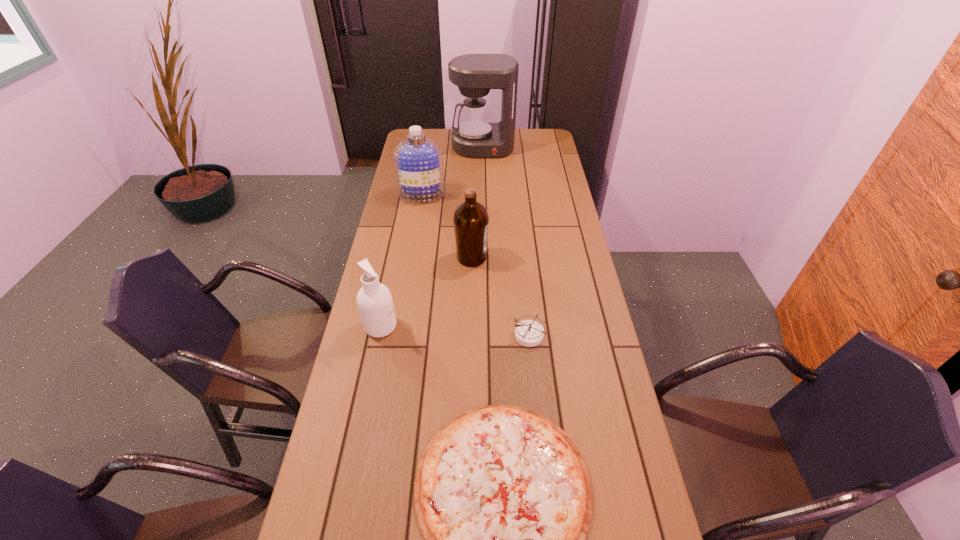
Locate an element on the screen. This screenshot has width=960, height=540. free space between the tallest object and the shorter cleansing agent is located at coordinates (432, 237).

Locate an element on the screen. Image resolution: width=960 pixels, height=540 pixels. vacant space in between the nearer cleansing agent and the compass is located at coordinates (455, 330).

At what (x,y) coordinates should I click in order to perform the action: click on free spot between the shorter cleansing agent and the tallest object. Please return your answer as a coordinate pair (x, y). The height and width of the screenshot is (540, 960). Looking at the image, I should click on (432, 237).

Image resolution: width=960 pixels, height=540 pixels. Identify the location of free spot between the farthest object and the second shortest object. (507, 241).

Where is `object that is the second closest to the farther cleansing agent`? This screenshot has width=960, height=540. object that is the second closest to the farther cleansing agent is located at coordinates (471, 220).

Find the location of a particular element. The width and height of the screenshot is (960, 540). the fifth closest object relative to the taller cleansing agent is located at coordinates (503, 497).

In order to click on vacant space that satisfies the following two spatial constraints: 1. on the front label of the second shortest object; 2. on the left side of the shorter cleansing agent in this screenshot , I will do point(379,335).

You are a GUI agent. You are given a task and a screenshot of the screen. Output one action in this format:
    pyautogui.click(x=<x>, y=<y>)
    Task: Click on the vacant space that satisfies the following two spatial constraints: 1. on the front side of the farther cleansing agent; 2. on the front label of the nearer cleansing agent
    This screenshot has height=540, width=960.
    Given the screenshot: What is the action you would take?
    pyautogui.click(x=400, y=326)

The image size is (960, 540). Find the location of `free space that satisfies the following two spatial constraints: 1. on the label of the fourth nearest object; 2. on the back side of the compass`. free space that satisfies the following two spatial constraints: 1. on the label of the fourth nearest object; 2. on the back side of the compass is located at coordinates (470, 335).

Image resolution: width=960 pixels, height=540 pixels. I want to click on vacant area that satisfies the following two spatial constraints: 1. on the label of the third farthest object; 2. on the left side of the compass, so click(470, 335).